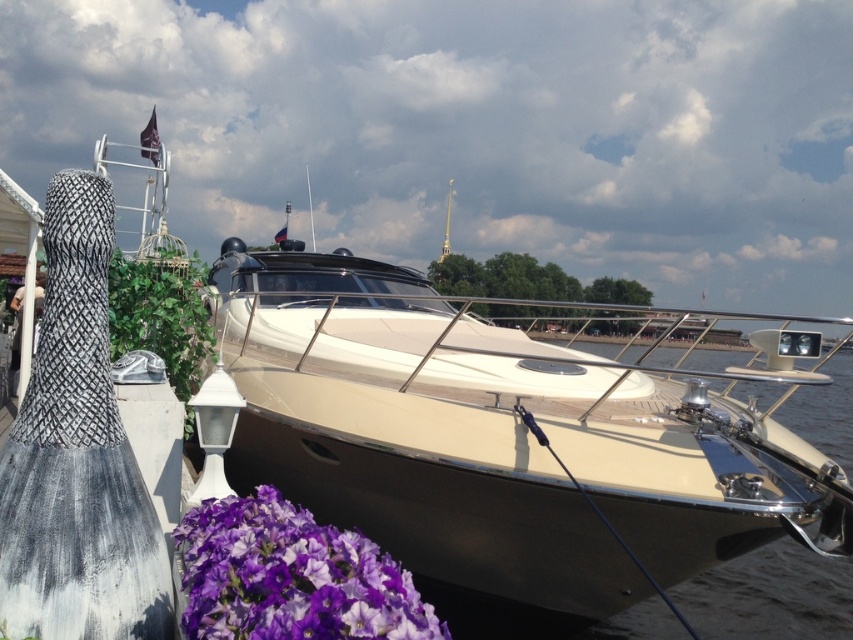
Is purple matte flower at lower left thinner than smooth beige water at center?

Correct, purple matte flower at lower left's width is less than smooth beige water at center's.

Is point (260, 637) positioned before point (656, 621)?

Yes, it is.

Locate an element on the screen. purple matte flower at lower left is located at coordinates (289, 577).

Describe the element at coordinates (497, 445) in the screenshot. I see `cream matte boat at center` at that location.

Can you confirm if cream matte boat at center is positioned to the left of purple matte flower at lower left?

No, cream matte boat at center is not to the left of purple matte flower at lower left.

Find the location of a particular element. cream matte boat at center is located at coordinates (497, 445).

Looking at this image, who is positioned more to the right, cream matte boat at center or smooth beige water at center?

smooth beige water at center is more to the right.

Identify the location of cream matte boat at center. (497, 445).